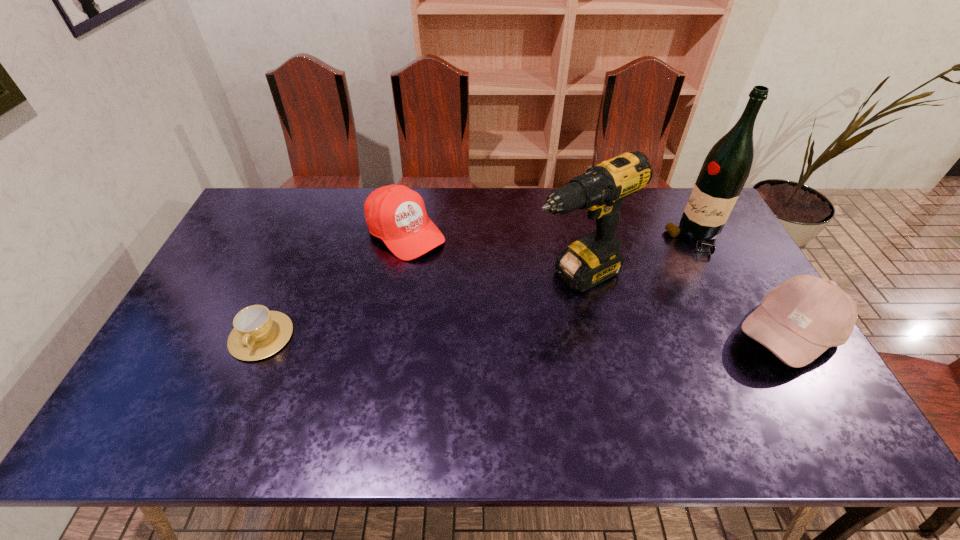
Identify the location of vacant space on the desktop that is between the cup and the right baseball cap and is positioned at the tip of the third object from left to right. The image size is (960, 540). 469,335.

Locate an element on the screen. The image size is (960, 540). free space on the desktop that is between the leftmost object and the nearer baseball cap and is positioned on the surface of the wine bottle is located at coordinates (581, 335).

This screenshot has width=960, height=540. Find the location of `free space on the desktop that is between the shortest object and the nearer baseball cap and is positioned on the front panel of the farther baseball cap`. free space on the desktop that is between the shortest object and the nearer baseball cap and is positioned on the front panel of the farther baseball cap is located at coordinates (521, 335).